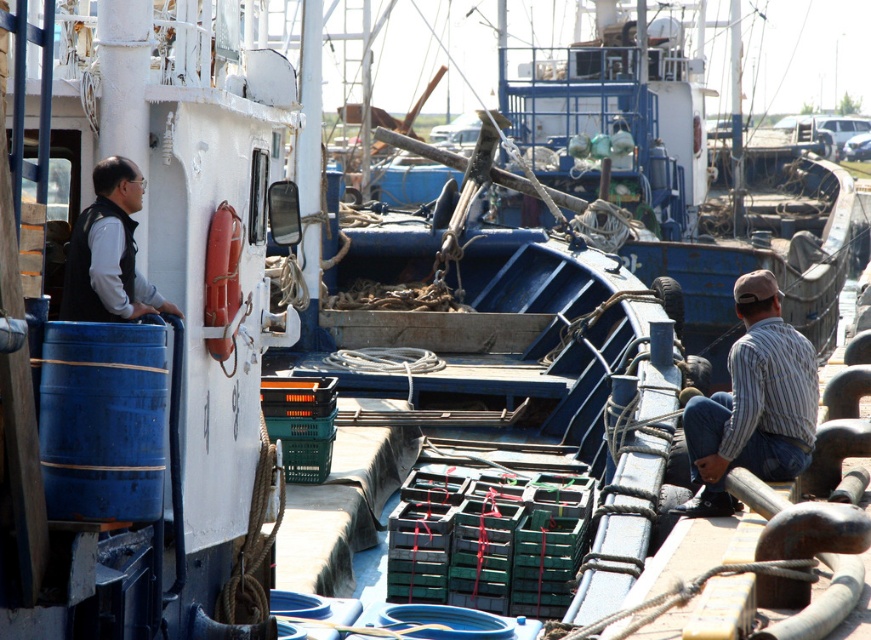
You are a photographer standing at the dock and want to take a photo of the striped cotton shirt at lower right without the blue painted wood boat at center blocking it. How should you adjust your position?

Move to the side so that the striped cotton shirt at lower right is no longer behind the blue painted wood boat at center.

You are a drone operator tasked with capturing aerial footage of the blue painted wood boat at center. The boat is located at coordinates point 0.270, 0.774. To ensure clear visibility, you need to position the drone in a way that avoids the containers and equipment in the middle ground. Based on the boat location, which direction should the drone move to capture the boat without obstruction?

The blue painted wood boat at center is located at point (x=673, y=172). To avoid the containers in the middle ground, the drone should move towards the lower right direction to capture the boat without obstruction.